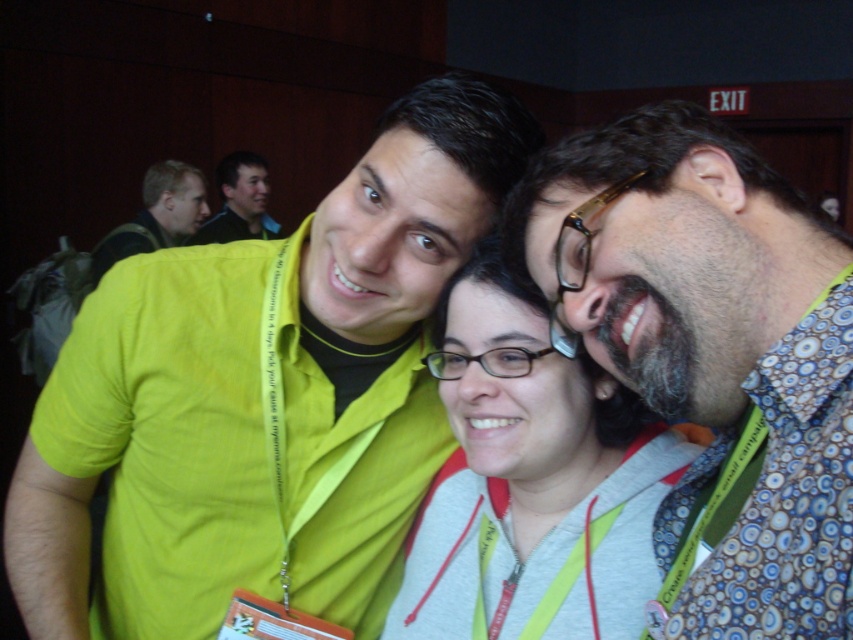
Question: Which point is farther from the camera taking this photo?

Choices:
 (A) (616, 426)
 (B) (189, 195)
 (C) (172, 275)

Answer: (B)

Question: Which object appears farthest from the camera in this image?

Choices:
 (A) green matte shirt at center
 (B) patterned fabric shirt at center
 (C) gray fleece at center
 (D) matte black shirt at upper left

Answer: (D)

Question: Does green matte shirt at center have a larger size compared to matte black shirt at upper left?

Choices:
 (A) yes
 (B) no

Answer: (A)

Question: Which object is farther from the camera taking this photo?

Choices:
 (A) matte black shirt at upper left
 (B) patterned fabric shirt at center
 (C) green matte shirt at center
 (D) matte yellow shirt at upper left

Answer: (A)

Question: Is gray fleece at center below matte yellow shirt at upper left?

Choices:
 (A) no
 (B) yes

Answer: (B)

Question: Does green matte shirt at center have a greater width compared to patterned fabric shirt at center?

Choices:
 (A) yes
 (B) no

Answer: (A)